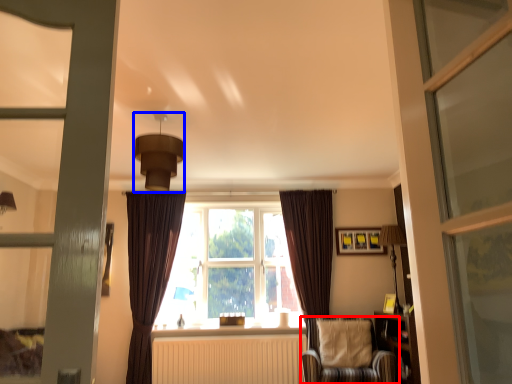
Question: Which of the following is the closest to the observer, chair (highlighted by a red box) or light fixture (highlighted by a blue box)?

Choices:
 (A) chair
 (B) light fixture

Answer: (B)